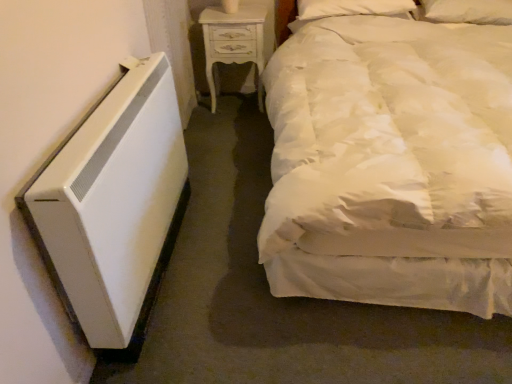
Question: From a real-world perspective, is white soft pillow at upper right, the first pillow positioned from the left, below white satin bed at right?

Choices:
 (A) no
 (B) yes

Answer: (A)

Question: Is white soft pillow at upper right, which ranks as the 2th pillow in right-to-left order, looking in the opposite direction of white satin bed at right?

Choices:
 (A) no
 (B) yes

Answer: (B)

Question: Does white soft pillow at upper right, which ranks as the 2th pillow in right-to-left order, have a larger size compared to white satin bed at right?

Choices:
 (A) yes
 (B) no

Answer: (B)

Question: Is white soft pillow at upper right, the first pillow positioned from the left, further to the viewer compared to white satin bed at right?

Choices:
 (A) no
 (B) yes

Answer: (B)

Question: Considering the relative sizes of white soft pillow at upper right, which ranks as the 2th pillow in right-to-left order, and white satin bed at right in the image provided, is white soft pillow at upper right, which ranks as the 2th pillow in right-to-left order, thinner than white satin bed at right?

Choices:
 (A) no
 (B) yes

Answer: (B)

Question: Does point (389, 8) appear closer or farther from the camera than point (403, 89)?

Choices:
 (A) farther
 (B) closer

Answer: (A)

Question: From a real-world perspective, is white soft pillow at upper right, the first pillow positioned from the left, physically located above or below white satin bed at right?

Choices:
 (A) above
 (B) below

Answer: (A)

Question: From the image's perspective, is white soft pillow at upper right, the first pillow positioned from the left, positioned above or below white satin bed at right?

Choices:
 (A) above
 (B) below

Answer: (A)

Question: Is white soft pillow at upper right, the first pillow positioned from the left, spatially inside white satin bed at right, or outside of it?

Choices:
 (A) inside
 (B) outside

Answer: (A)

Question: Is white soft pillow at upper right, positioned as the 1th pillow in right-to-left order, inside or outside of white painted wood nightstand at upper center?

Choices:
 (A) inside
 (B) outside

Answer: (B)

Question: From the image's perspective, relative to white painted wood nightstand at upper center, is white soft pillow at upper right, which ranks as the second pillow in left-to-right order, above or below?

Choices:
 (A) above
 (B) below

Answer: (A)

Question: From a real-world perspective, is white soft pillow at upper right, positioned as the 1th pillow in right-to-left order, physically located above or below white painted wood nightstand at upper center?

Choices:
 (A) below
 (B) above

Answer: (B)

Question: Is white soft pillow at upper right, positioned as the 1th pillow in right-to-left order, bigger or smaller than white painted wood nightstand at upper center?

Choices:
 (A) small
 (B) big

Answer: (A)

Question: Based on their positions, is white soft pillow at upper right, which ranks as the second pillow in left-to-right order, located to the left or right of white soft pillow at upper right, the first pillow positioned from the left?

Choices:
 (A) right
 (B) left

Answer: (A)

Question: Does point (428, 0) appear closer or farther from the camera than point (303, 0)?

Choices:
 (A) closer
 (B) farther

Answer: (A)